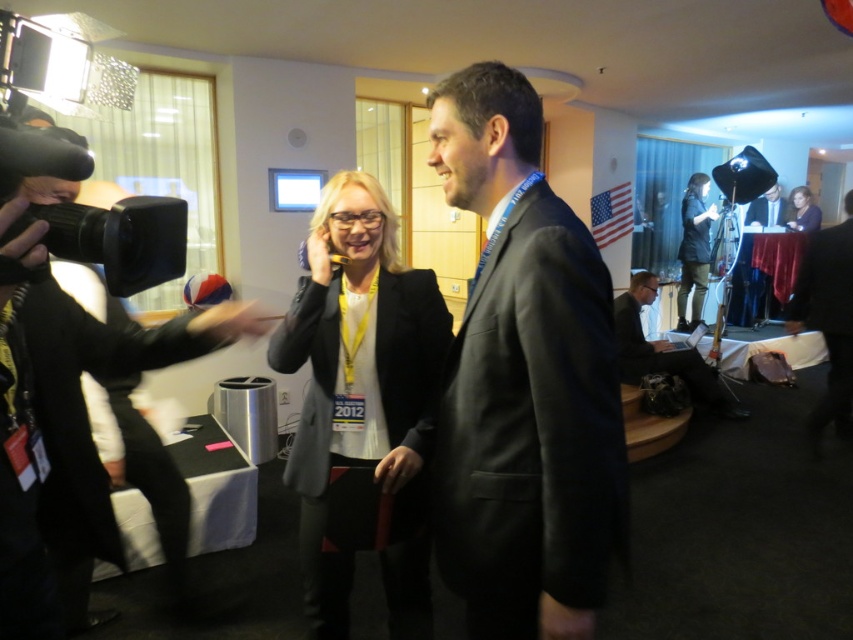
Who is taller, dark blue suit at right or matte black jacket at upper right?

dark blue suit at right

Who is more distant from viewer, (756, 218) or (810, 216)?

Point (756, 218)

Identify the location of dark blue suit at right. This screenshot has width=853, height=640. (766, 209).

Between black matte suit at left and matte black jacket at upper right, which one is positioned lower?

Positioned lower is black matte suit at left.

Can you confirm if black matte suit at left is wider than matte black jacket at upper right?

Yes.

Measure the distance between point (15,518) and camera.

Point (15,518) and camera are 3.70 feet apart.

In order to click on black matte suit at left in this screenshot , I will do `click(90, 433)`.

Between point (844, 365) and point (778, 220), which one is positioned in front?

Point (844, 365) is in front.

From the picture: Does black fabric hat at right have a greater height compared to dark suit at center?

Correct, black fabric hat at right is much taller as dark suit at center.

Is point (849, 234) positioned in front of point (751, 212)?

Yes, it is.

Locate an element on the screen. This screenshot has height=640, width=853. black fabric hat at right is located at coordinates (828, 317).